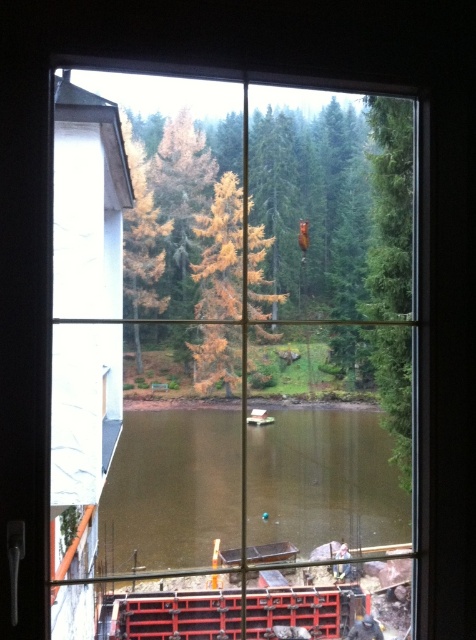
Who is taller, transparent glass window at center or brown murky water at center?

transparent glass window at center

Consider the image. Who is shorter, transparent glass window at center or brown murky water at center?

brown murky water at center is shorter.

The width and height of the screenshot is (476, 640). I want to click on transparent glass window at center, so click(229, 353).